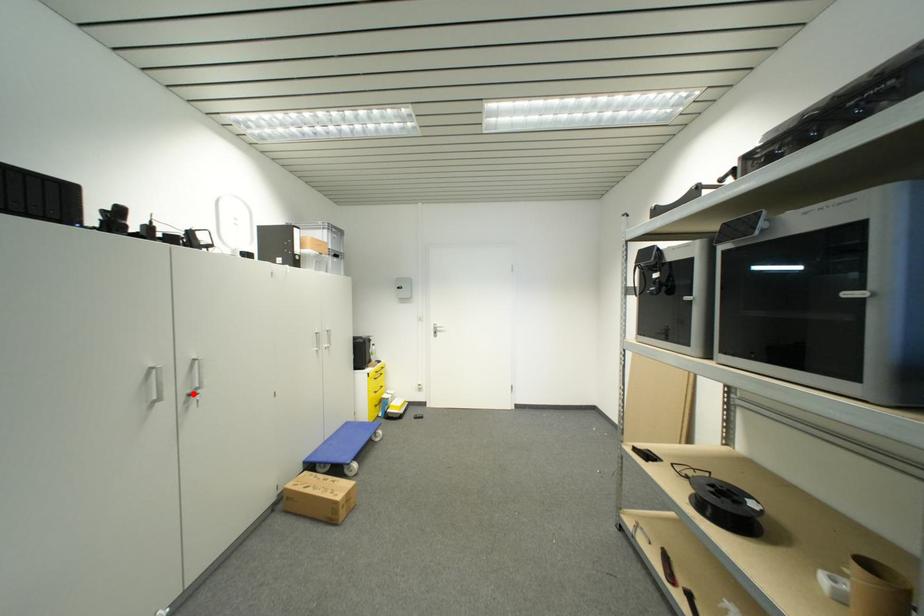
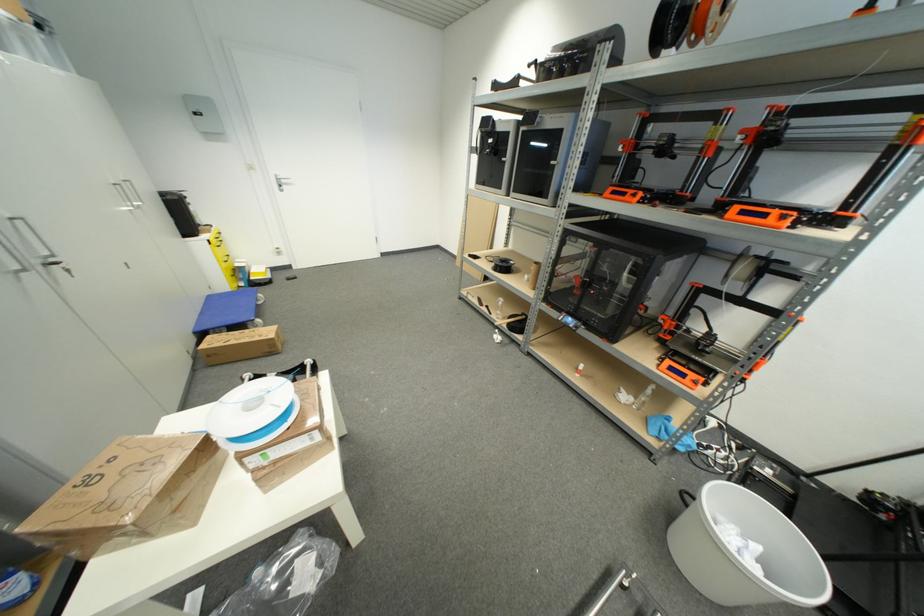
Question: I am providing you with two images of the same scene from different viewpoints. In image1, a red point is highlighted. Considering the same 3D point in image2, which of the following is correct?

Choices:
 (A) It is closer
 (B) It is farther

Answer: (B)